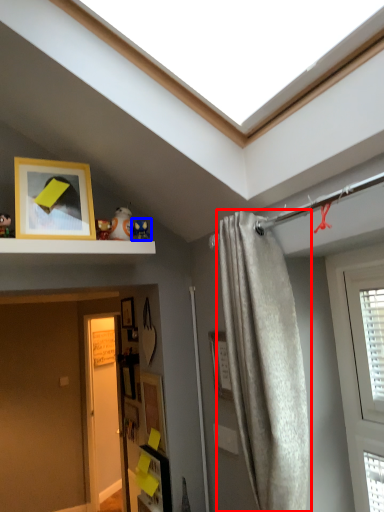
Question: Which of the following is the farthest to the observer, curtain (highlighted by a red box) or toy (highlighted by a blue box)?

Choices:
 (A) curtain
 (B) toy

Answer: (B)